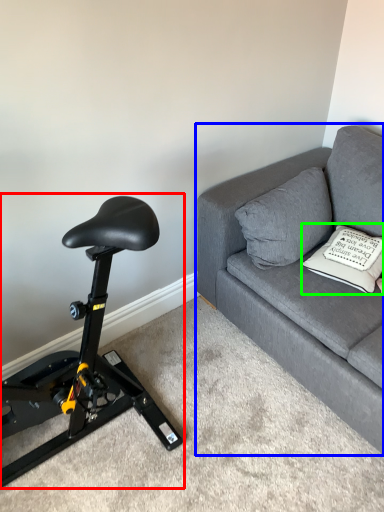
Question: Which is nearer to the stationary bicycle (highlighted by a red box)? studio couch (highlighted by a blue box) or pillow (highlighted by a green box).

Choices:
 (A) studio couch
 (B) pillow

Answer: (A)